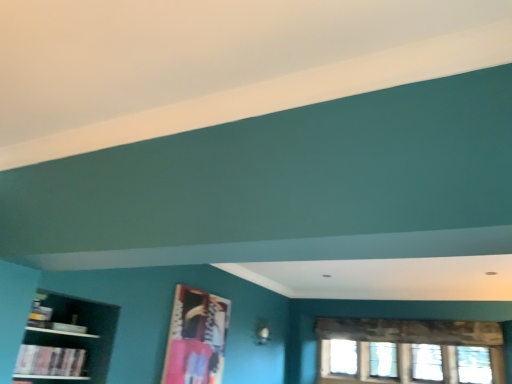
Question: Is hardcover book at lower left taller or shorter than metallic silver picture frame at center?

Choices:
 (A) tall
 (B) short

Answer: (B)

Question: From a real-world perspective, is hardcover book at lower left above or below metallic silver picture frame at center?

Choices:
 (A) above
 (B) below

Answer: (B)

Question: Which object is the closest to the hardcover book at lower left?

Choices:
 (A) clear glass window at lower right
 (B) dark wood shelf at left
 (C) metallic silver picture frame at center

Answer: (B)

Question: Which object is positioned closest to the dark wood shelf at left?

Choices:
 (A) clear glass window at lower right
 (B) hardcover book at lower left
 (C) metallic silver picture frame at center

Answer: (B)